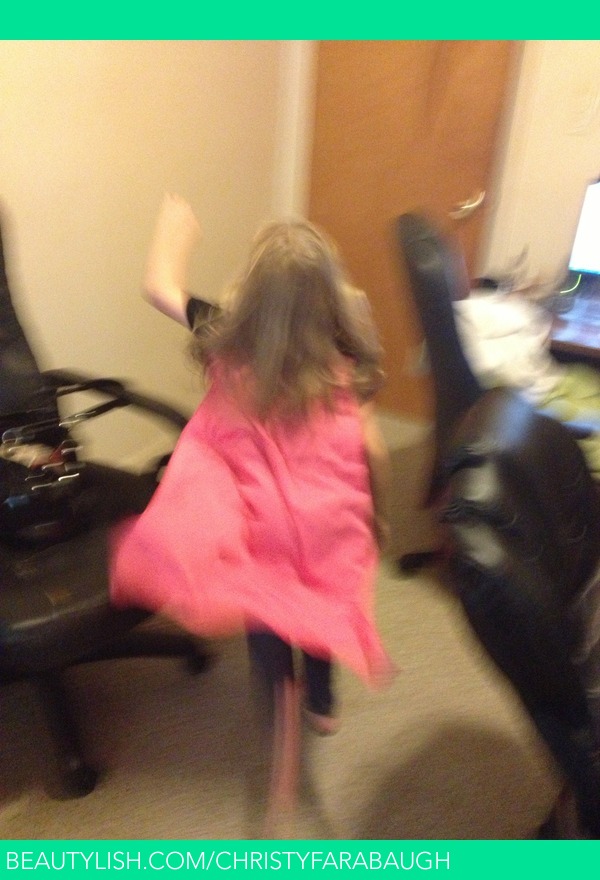
At what (x,y) coordinates should I click in order to perform the action: click on blurry beige colored floor. Please return your answer as a coordinate pair (x, y). This screenshot has height=880, width=600. Looking at the image, I should click on (428, 671).